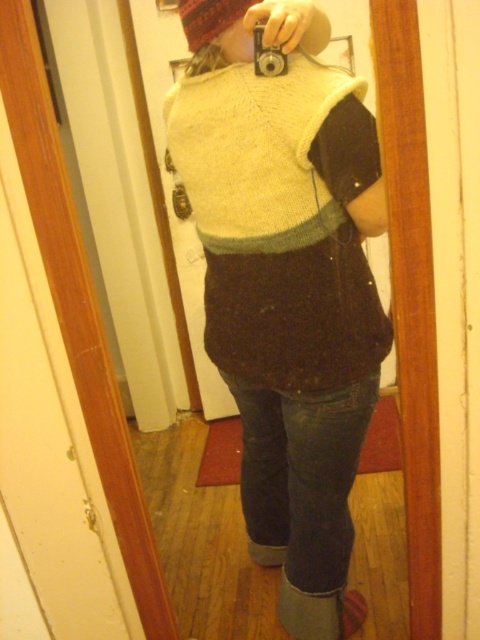
Does point (276, 16) come behind point (267, 51)?

No, it is in front of (267, 51).

Is fuzzy woolen hat at upper center positioned before silver metallic camera at upper center?

Yes, fuzzy woolen hat at upper center is closer to the viewer.

Describe the element at coordinates (255, 22) in the screenshot. The image size is (480, 640). I see `fuzzy woolen hat at upper center` at that location.

Identify the location of fuzzy woolen hat at upper center. This screenshot has width=480, height=640. (255, 22).

Does white knitted sweater at center come behind silver metallic camera at upper center?

That is False.

What do you see at coordinates (257, 154) in the screenshot?
I see `white knitted sweater at center` at bounding box center [257, 154].

Between point (321, 188) and point (265, 58), which one is positioned behind?

Positioned behind is point (321, 188).

I want to click on white knitted sweater at center, so point(257,154).

Does white knitted sweater at center have a greater height compared to fuzzy woolen hat at upper center?

Indeed, white knitted sweater at center has a greater height compared to fuzzy woolen hat at upper center.

Based on the photo, who is higher up, white knitted sweater at center or fuzzy woolen hat at upper center?

fuzzy woolen hat at upper center is higher up.

Who is more distant from viewer, (x=275, y=216) or (x=230, y=20)?

The point (x=275, y=216) is behind.

In order to click on white knitted sweater at center in this screenshot , I will do `click(257, 154)`.